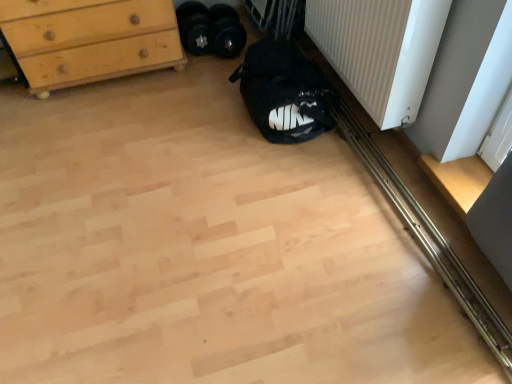
What are the coordinates of `free point in front of black fabric sleeping bag at lower center` in the screenshot? It's located at (272, 171).